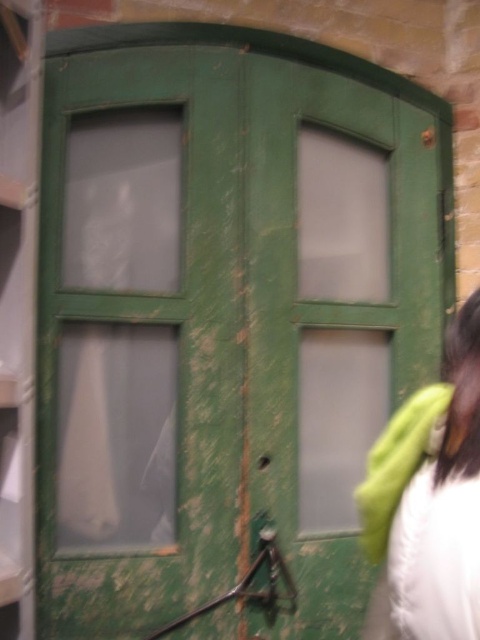
In the scene shown: Is white fabric at right to the left of green matte jacket at lower right from the viewer's perspective?

In fact, white fabric at right is to the right of green matte jacket at lower right.

Between point (404, 524) and point (439, 413), which one is positioned in front?

Positioned in front is point (404, 524).

Where is `white fabric at right`? white fabric at right is located at coordinates (429, 502).